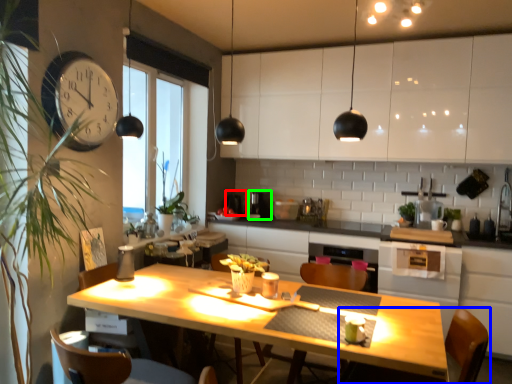
Question: Based on their relative distances, which object is farther from coffee machine (highlighted by a red box)? Choose from chair (highlighted by a blue box) and coffee machine (highlighted by a green box).

Choices:
 (A) chair
 (B) coffee machine

Answer: (A)